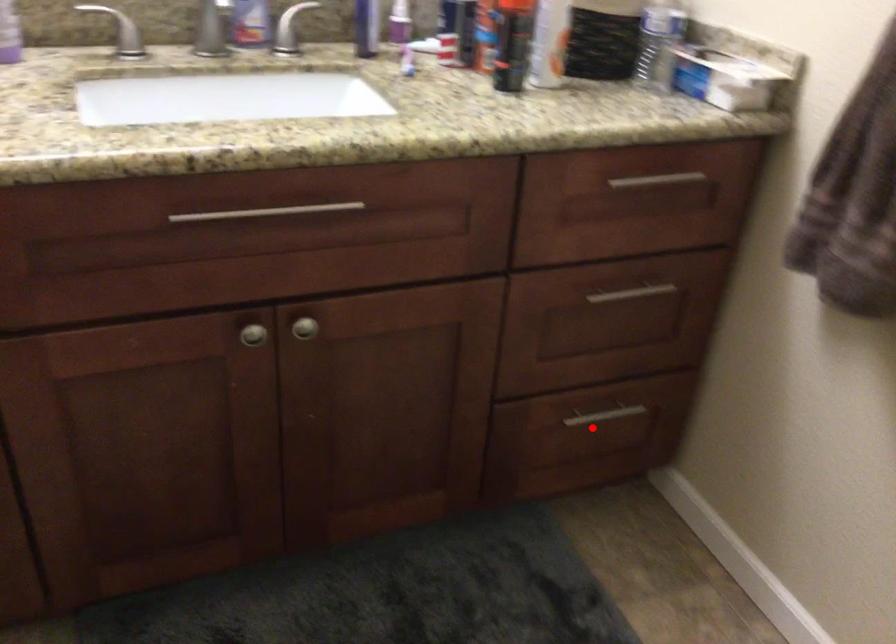
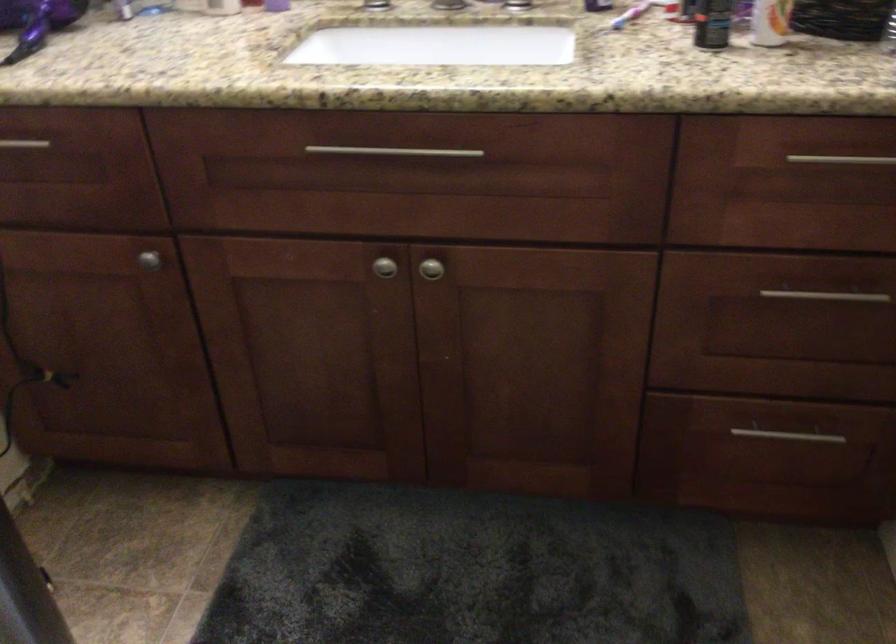
Where in the second image is the point corresponding to the highlighted location from the first image?

(778, 446)